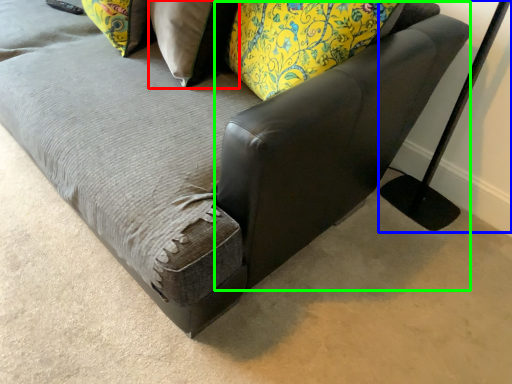
Question: Considering the real-world distances, which object is farthest from pillow (highlighted by a red box)? table lamp (highlighted by a blue box) or swivel chair (highlighted by a green box)?

Choices:
 (A) table lamp
 (B) swivel chair

Answer: (A)